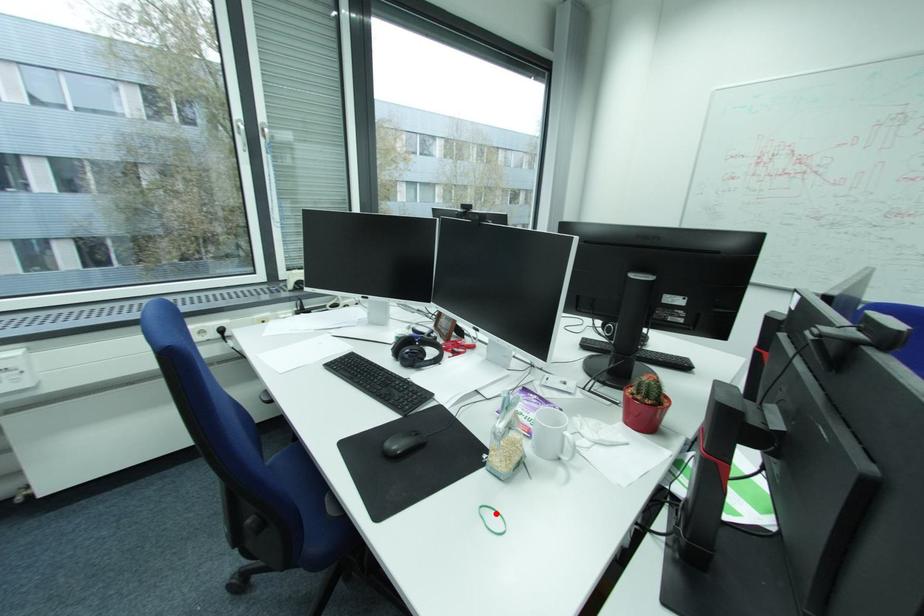
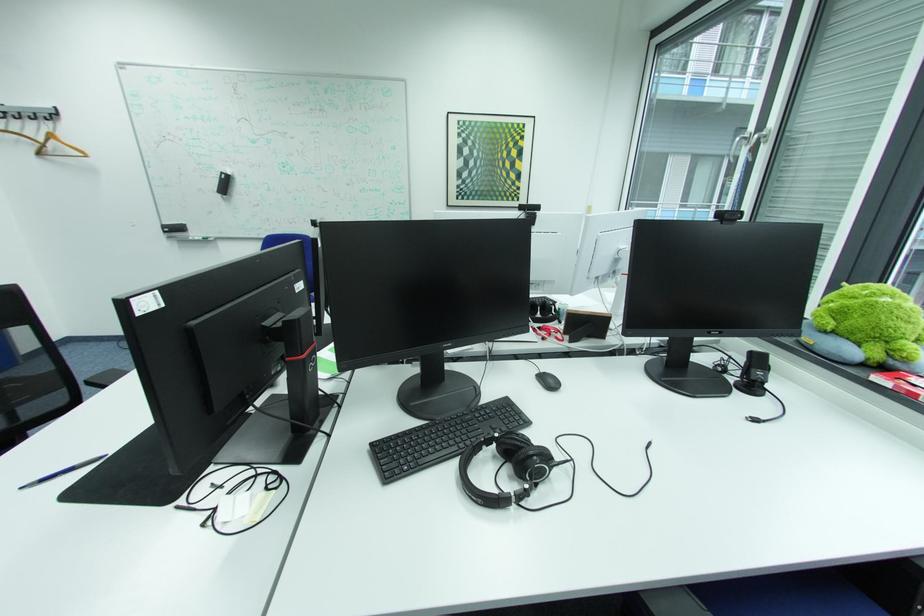
Question: I am providing you with two images of the same scene from different viewpoints. A red point is marked on the first image. Is the red point's position out of view in image 2?

Choices:
 (A) Yes
 (B) No

Answer: (A)